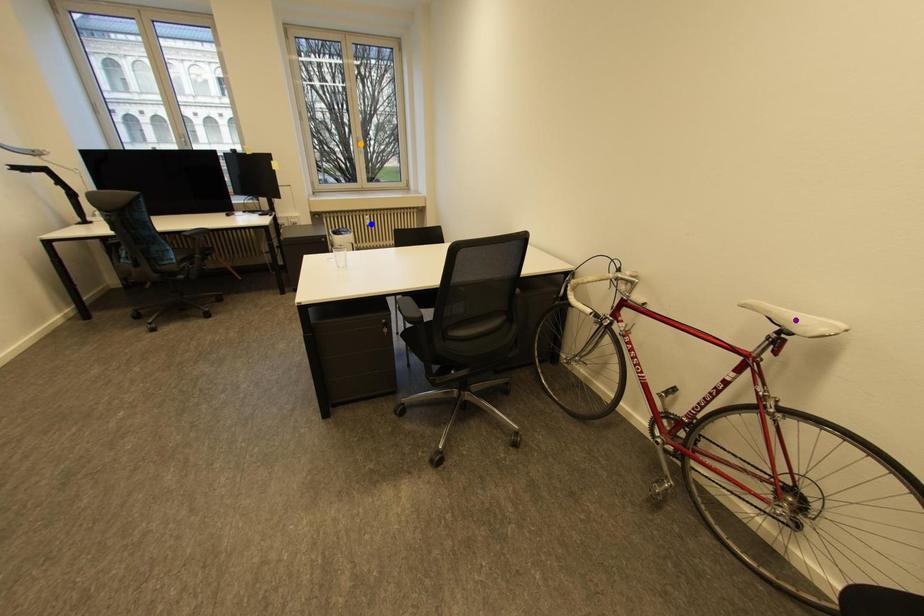
Order these from nearest to farthest:
orange point, purple point, blue point

purple point → blue point → orange point